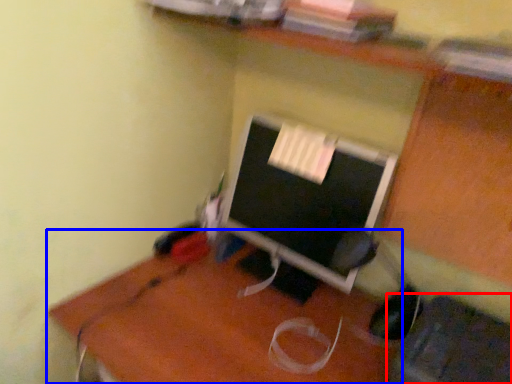
Question: Which of the following is the farthest to the observer, computer chair (highlighted by a red box) or desk (highlighted by a blue box)?

Choices:
 (A) computer chair
 (B) desk

Answer: (B)